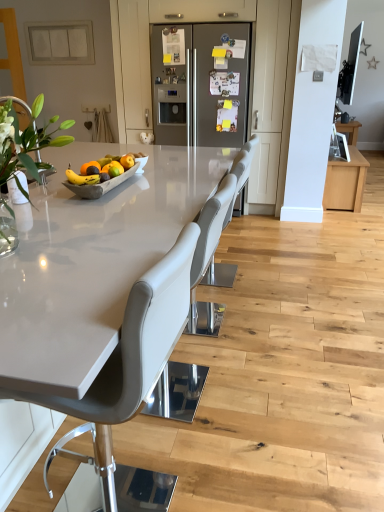
Question: Is there a large distance between matte gray chair at center, which is the third chair in back-to-front order, and white glossy countertop at center?

Choices:
 (A) no
 (B) yes

Answer: (A)

Question: Is white glossy countertop at center located within matte gray chair at center, placed as the first chair when sorted from front to back?

Choices:
 (A) no
 (B) yes

Answer: (A)

Question: From a real-world perspective, is matte gray chair at center, which is the third chair in back-to-front order, on top of white glossy countertop at center?

Choices:
 (A) no
 (B) yes

Answer: (B)

Question: Is matte gray chair at center, which is the third chair in back-to-front order, bigger than white glossy countertop at center?

Choices:
 (A) yes
 (B) no

Answer: (B)

Question: From the image's perspective, is matte gray chair at center, placed as the first chair when sorted from front to back, under white glossy countertop at center?

Choices:
 (A) no
 (B) yes

Answer: (B)

Question: Is matte gray chair at center, which is the third chair in back-to-front order, positioned beyond the bounds of white glossy countertop at center?

Choices:
 (A) yes
 (B) no

Answer: (B)

Question: Is matte gray chair at center, placed as the first chair when sorted from front to back, aimed at gray leather chair at center, the 2th chair in the front-to-back sequence?

Choices:
 (A) no
 (B) yes

Answer: (A)

Question: Is matte gray chair at center, which is the third chair in back-to-front order, shorter than gray leather chair at center, the second chair from the back?

Choices:
 (A) yes
 (B) no

Answer: (B)

Question: From a real-world perspective, is matte gray chair at center, placed as the first chair when sorted from front to back, below gray leather chair at center, the second chair from the back?

Choices:
 (A) yes
 (B) no

Answer: (B)

Question: Considering the relative sizes of matte gray chair at center, placed as the first chair when sorted from front to back, and gray leather chair at center, the 2th chair in the front-to-back sequence, in the image provided, is matte gray chair at center, placed as the first chair when sorted from front to back, smaller than gray leather chair at center, the 2th chair in the front-to-back sequence,?

Choices:
 (A) no
 (B) yes

Answer: (B)

Question: Can you confirm if matte gray chair at center, placed as the first chair when sorted from front to back, is wider than gray leather chair at center, the 2th chair in the front-to-back sequence?

Choices:
 (A) no
 (B) yes

Answer: (A)

Question: Is matte gray chair at center, placed as the first chair when sorted from front to back, thinner than gray leather chair at center, the 2th chair in the front-to-back sequence?

Choices:
 (A) yes
 (B) no

Answer: (A)

Question: Is white matte switch plate at upper left, which ranks as the 2th cabinetry in right-to-left order, next to orangesmoothfruit at center and touching it?

Choices:
 (A) no
 (B) yes

Answer: (A)